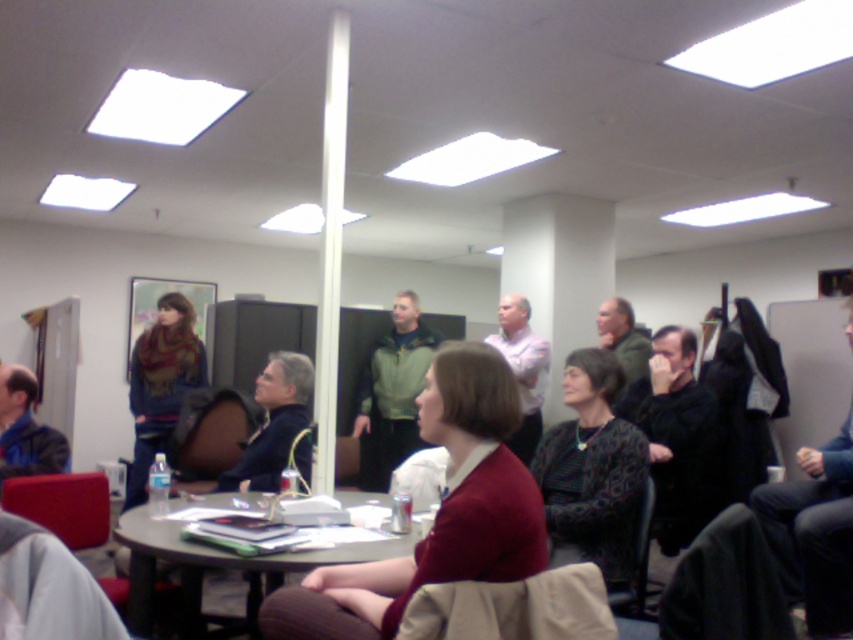
Is maroon sweater at center smaller than wooden table at center?

Yes.

Which is below, maroon sweater at center or wooden table at center?

Positioned lower is wooden table at center.

You are a GUI agent. You are given a task and a screenshot of the screen. Output one action in this format:
    pyautogui.click(x=<x>, y=<y>)
    Task: Click on the maroon sweater at center
    The height and width of the screenshot is (640, 853).
    Given the screenshot: What is the action you would take?
    pyautogui.click(x=437, y=512)

Find the location of a particular element. The image size is (853, 640). maroon sweater at center is located at coordinates (437, 512).